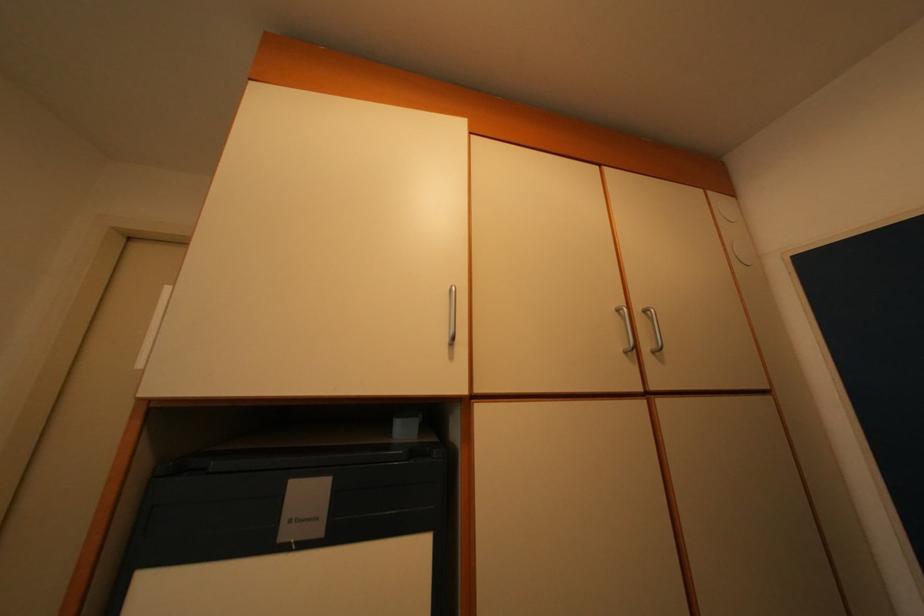
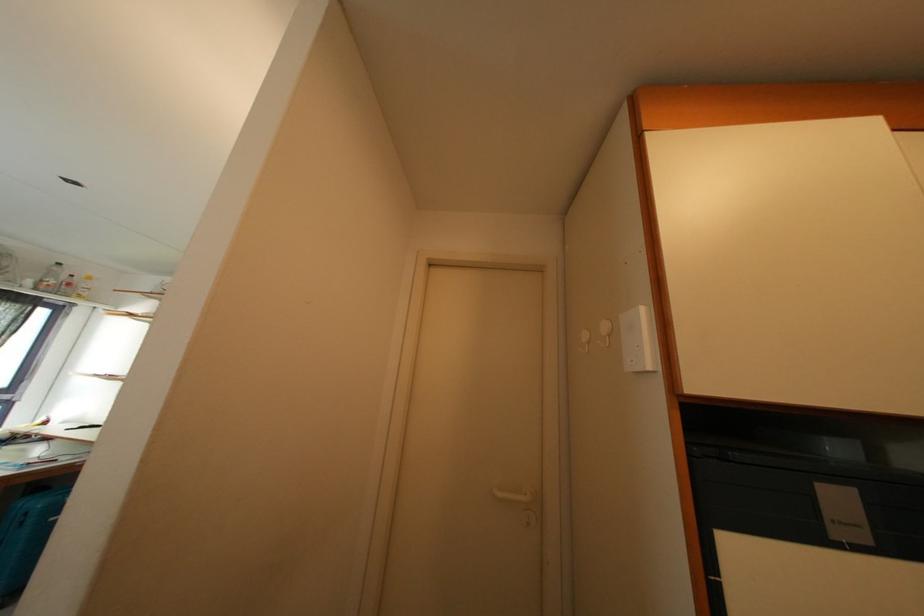
Question: The images are taken continuously from a first-person perspective. In which direction are you moving?

Choices:
 (A) Left
 (B) Right
 (C) Forward
 (D) Backward

Answer: (A)